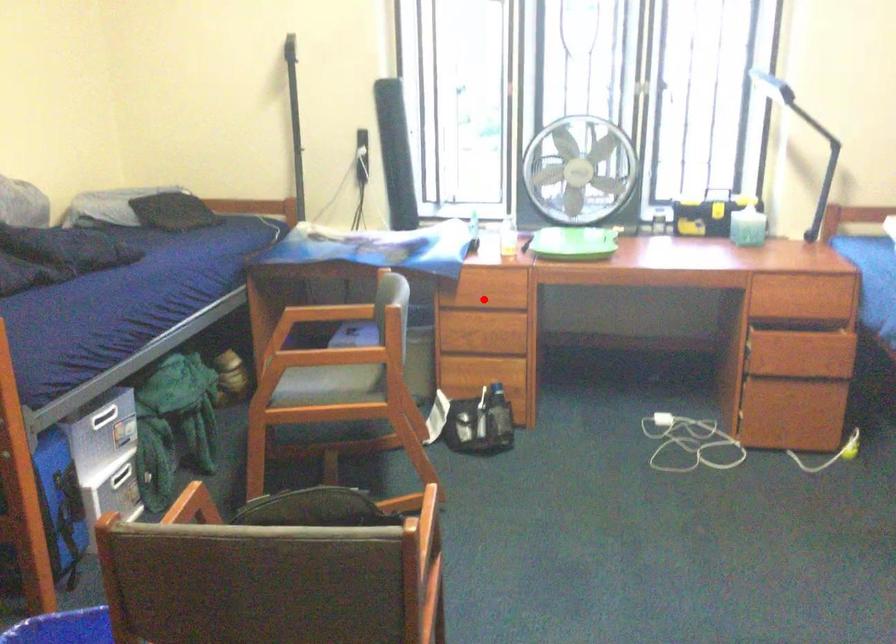
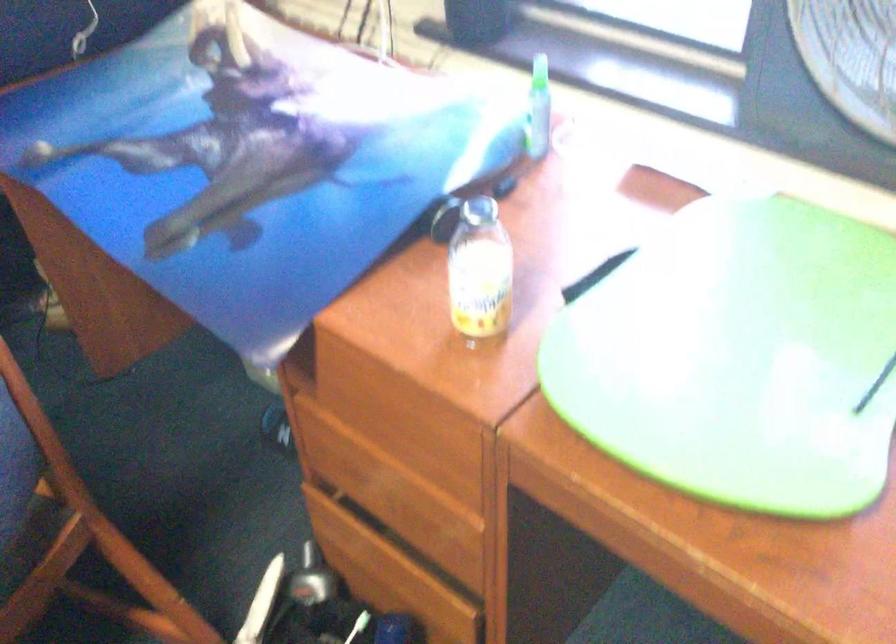
Question: I am providing you with two images of the same scene from different viewpoints. Given a red point in image1, look at the same physical point in image2. Is it:

Choices:
 (A) Closer to the viewpoint
 (B) Farther from the viewpoint

Answer: (A)